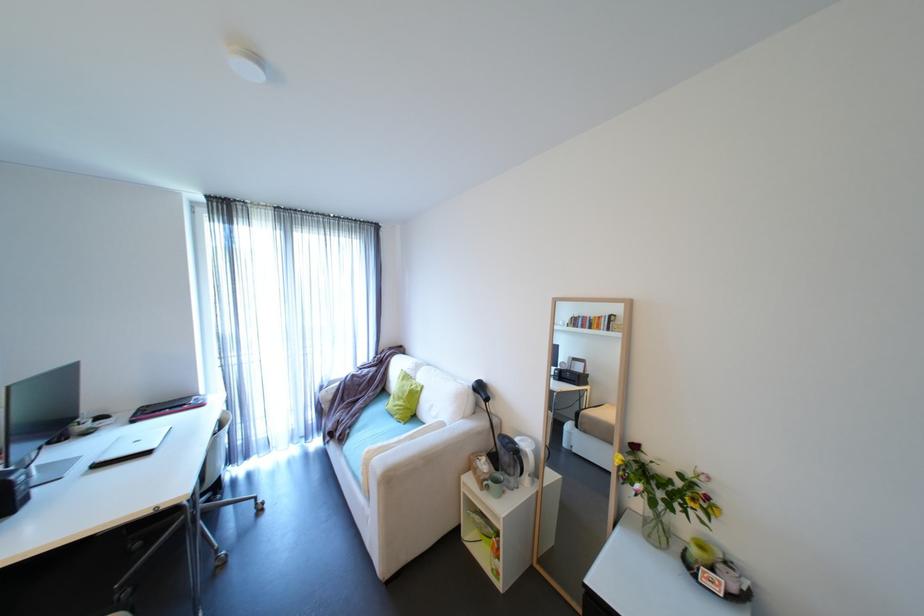
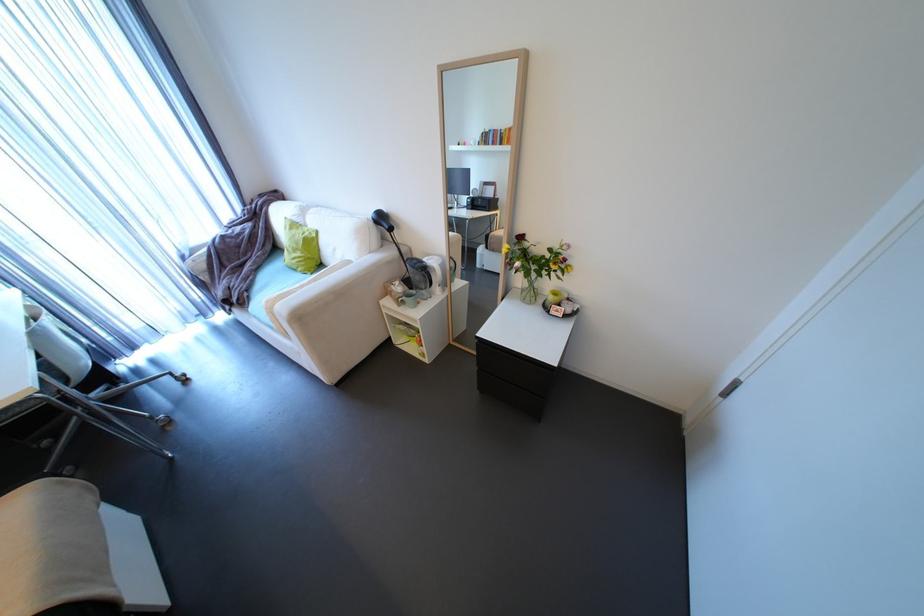
Locate, in the second image, the point that corresponds to (x=411, y=424) in the first image.

(319, 274)